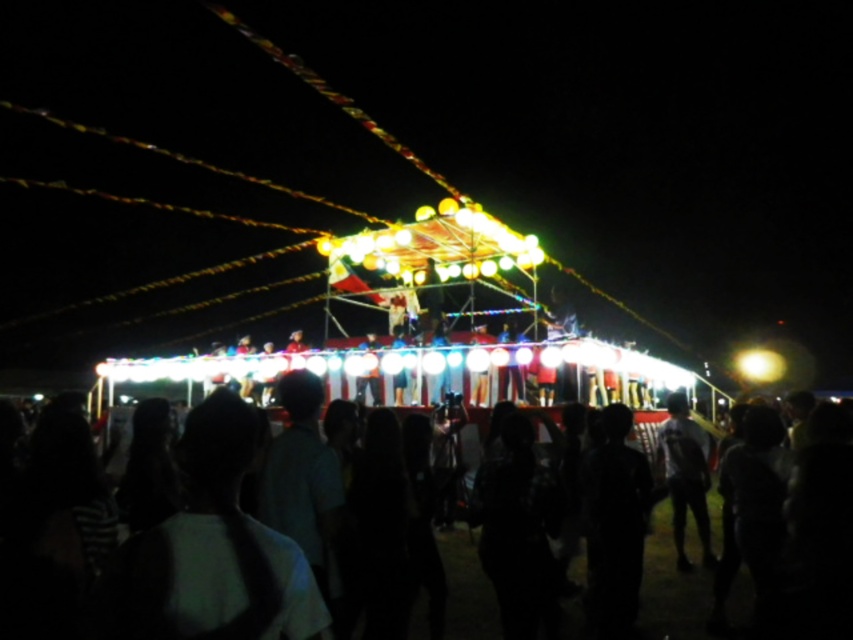
The image size is (853, 640). What do you see at coordinates (670, 588) in the screenshot?
I see `black matte crowd at center` at bounding box center [670, 588].

Does black matte crowd at center have a greater height compared to dark gray fabric shirt at center?

No.

In order to click on black matte crowd at center in this screenshot , I will do click(670, 588).

Find the location of a particular element. The image size is (853, 640). black matte crowd at center is located at coordinates (670, 588).